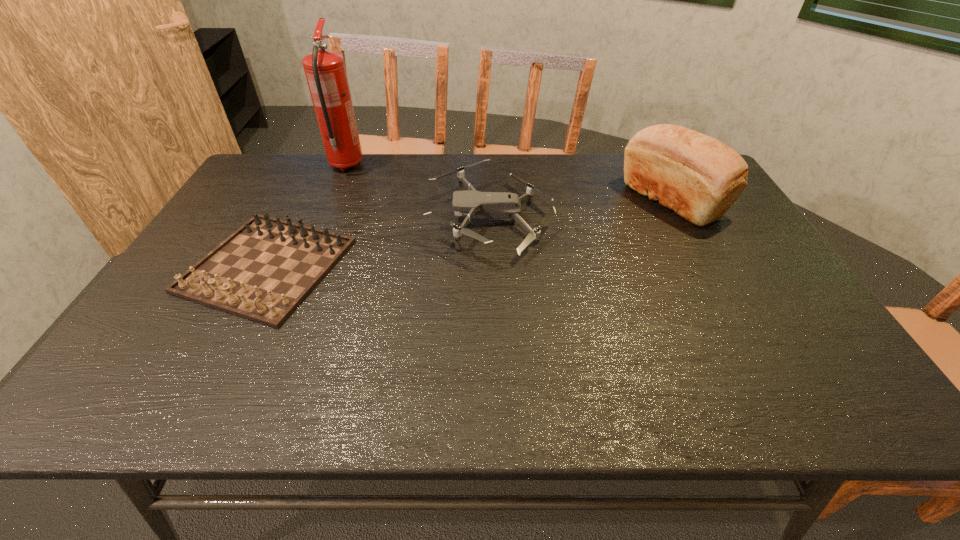
This screenshot has width=960, height=540. Find the location of `vacant position at the near left corner of the desktop`. vacant position at the near left corner of the desktop is located at coordinates (134, 410).

Locate an element on the screen. vacant region between the third shortest object and the tallest object is located at coordinates (509, 183).

I want to click on unoccupied area between the chessboard and the tallest object, so click(x=306, y=215).

Find the location of a particular element. blank region between the bread and the fire extinguisher is located at coordinates (509, 183).

Where is `unoccupied area between the drone and the third shortest object`? The image size is (960, 540). unoccupied area between the drone and the third shortest object is located at coordinates (581, 210).

You are a GUI agent. You are given a task and a screenshot of the screen. Output one action in this format:
    pyautogui.click(x=<x>, y=<y>)
    Task: Click on the free space that is in between the bread and the drone
    This screenshot has width=960, height=540.
    Given the screenshot: What is the action you would take?
    pyautogui.click(x=581, y=210)

Select which object is the third closest to the rightmost object. Please provide its 2D coordinates. Your answer should be formatted as a tuple, i.e. [(x, y)], where the tuple contains the x and y coordinates of a point satisfying the conditions above.

[(325, 71)]

You are a GUI agent. You are given a task and a screenshot of the screen. Output one action in this format:
    pyautogui.click(x=<x>, y=<y>)
    Task: Click on the object that is the third closest to the second object from right to left
    
    Given the screenshot: What is the action you would take?
    pyautogui.click(x=325, y=71)

At what (x,y) coordinates should I click in order to perform the action: click on vacant space that satisfies the following two spatial constraints: 1. on the front side of the bread; 2. on the front-facing side of the second object from right to left. Please return your answer as a coordinate pair (x, y). The height and width of the screenshot is (540, 960). Looking at the image, I should click on (682, 219).

Find the location of a particular element. This screenshot has height=540, width=960. free space that satisfies the following two spatial constraints: 1. on the back side of the chessboard; 2. on the left side of the bread is located at coordinates (300, 200).